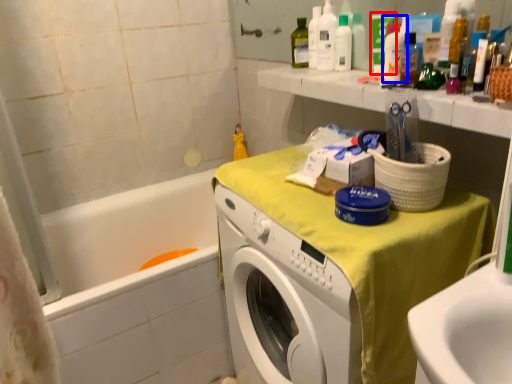
Question: Among these objects, which one is nearest to the camera, toiletry (highlighted by a red box) or cleaning product (highlighted by a blue box)?

Choices:
 (A) toiletry
 (B) cleaning product

Answer: (B)